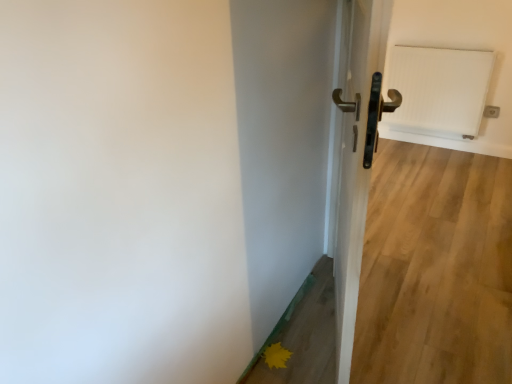
Question: Is yellow matte flower at lower right with white textured radiator at upper right?

Choices:
 (A) yes
 (B) no

Answer: (B)

Question: Can you confirm if yellow matte flower at lower right is positioned to the left of white textured radiator at upper right?

Choices:
 (A) yes
 (B) no

Answer: (A)

Question: Is yellow matte flower at lower right positioned beyond the bounds of white textured radiator at upper right?

Choices:
 (A) no
 (B) yes

Answer: (B)

Question: From a real-world perspective, is yellow matte flower at lower right over white textured radiator at upper right?

Choices:
 (A) no
 (B) yes

Answer: (A)

Question: Is yellow matte flower at lower right looking in the opposite direction of white textured radiator at upper right?

Choices:
 (A) no
 (B) yes

Answer: (A)

Question: Is yellow matte flower at lower right bigger than white textured radiator at upper right?

Choices:
 (A) no
 (B) yes

Answer: (A)

Question: Can you confirm if metallic gold door handle at center is smaller than yellow matte flower at lower right?

Choices:
 (A) no
 (B) yes

Answer: (A)

Question: Is metallic gold door handle at center at the right side of yellow matte flower at lower right?

Choices:
 (A) no
 (B) yes

Answer: (B)

Question: Can you confirm if metallic gold door handle at center is bigger than yellow matte flower at lower right?

Choices:
 (A) no
 (B) yes

Answer: (B)

Question: Is metallic gold door handle at center beside yellow matte flower at lower right?

Choices:
 (A) yes
 (B) no

Answer: (B)

Question: From the image's perspective, is metallic gold door handle at center beneath yellow matte flower at lower right?

Choices:
 (A) no
 (B) yes

Answer: (A)

Question: From the image's perspective, is metallic gold door handle at center above yellow matte flower at lower right?

Choices:
 (A) yes
 (B) no

Answer: (A)

Question: Does metallic gold door handle at center appear on the right side of white textured radiator at upper right?

Choices:
 (A) yes
 (B) no

Answer: (B)